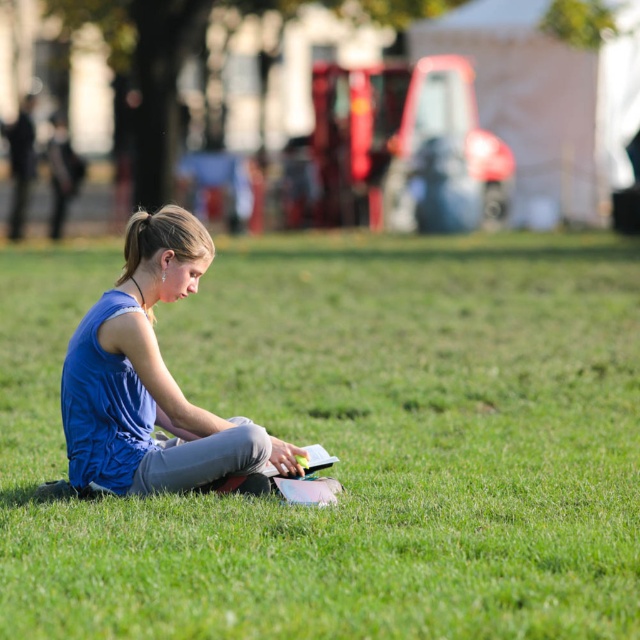
Based on the photo, you are a photographer trying to capture the scene of the blue fabric girl at center and the green grassy at center. If you want to focus on the girl while keeping the grass in the background, which object should be closer to the camera?

The blue fabric girl at center should be closer to the camera because the green grassy at center is in front of her, meaning the girl is behind the grass and thus would be in the background if the grass is closer. To have the girl in focus and the grass as background, the girl needs to be positioned closer to the camera than the grass. Wait, there might be confusion here. Let me think again. The description says the grass is in front of the girl. So if the grass is in front, then the girl is behind thegrass